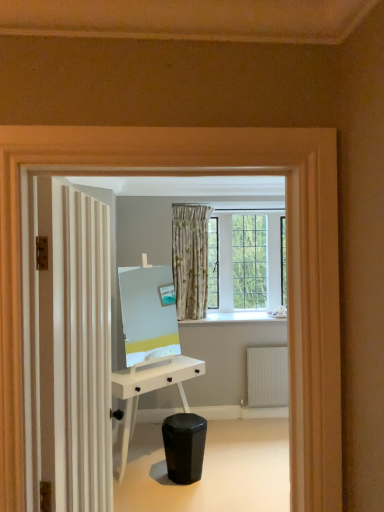
Question: Based on their positions, is black matte swivel chair at lower center located to the left or right of white ribbed radiator at lower right?

Choices:
 (A) right
 (B) left

Answer: (B)

Question: Considering the positions of black matte swivel chair at lower center and white ribbed radiator at lower right in the image, is black matte swivel chair at lower center wider or thinner than white ribbed radiator at lower right?

Choices:
 (A) wide
 (B) thin

Answer: (A)

Question: Estimate the real-world distances between objects in this image. Which object is farther from the white textured door at left?

Choices:
 (A) white ribbed radiator at lower right
 (B) black matte swivel chair at lower center
 (C) white matte desk at center

Answer: (A)

Question: Considering the real-world distances, which object is closest to the white textured door at left?

Choices:
 (A) black matte swivel chair at lower center
 (B) white ribbed radiator at lower right
 (C) white matte desk at center

Answer: (A)